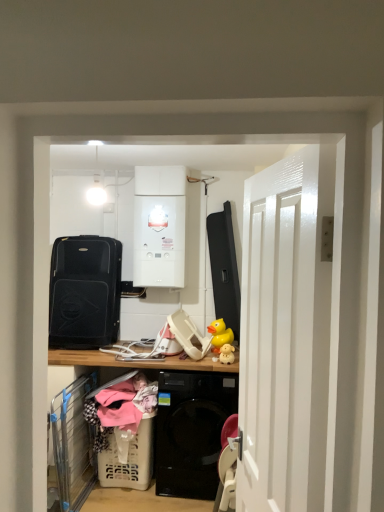
Question: Does white glossy boiler at upper center, which appears as the second appliance when viewed from the left, lie in front of white glossy door at right?

Choices:
 (A) yes
 (B) no

Answer: (B)

Question: Is white glossy boiler at upper center, which appears as the second appliance when viewed from the left, turned away from white glossy door at right?

Choices:
 (A) no
 (B) yes

Answer: (A)

Question: From a real-world perspective, is white glossy boiler at upper center, which appears as the second appliance when viewed from the left, positioned under white glossy door at right based on gravity?

Choices:
 (A) yes
 (B) no

Answer: (B)

Question: From the image's perspective, is white glossy boiler at upper center, acting as the first appliance starting from the right, beneath white glossy door at right?

Choices:
 (A) yes
 (B) no

Answer: (B)

Question: Does white glossy boiler at upper center, acting as the first appliance starting from the right, come behind white glossy door at right?

Choices:
 (A) yes
 (B) no

Answer: (A)

Question: Can you confirm if white glossy boiler at upper center, which appears as the second appliance when viewed from the left, is shorter than white glossy door at right?

Choices:
 (A) no
 (B) yes

Answer: (B)

Question: Considering the relative sizes of white glossy door at right and yellow rubber duck at center in the image provided, is white glossy door at right bigger than yellow rubber duck at center?

Choices:
 (A) no
 (B) yes

Answer: (B)

Question: From the image's perspective, is white glossy door at right on yellow rubber duck at center?

Choices:
 (A) yes
 (B) no

Answer: (A)

Question: Is the position of white glossy door at right less distant than that of yellow rubber duck at center?

Choices:
 (A) yes
 (B) no

Answer: (A)

Question: From a real-world perspective, is white glossy door at right positioned under yellow rubber duck at center based on gravity?

Choices:
 (A) yes
 (B) no

Answer: (B)

Question: Can you confirm if white glossy door at right is positioned to the left of yellow rubber duck at center?

Choices:
 (A) yes
 (B) no

Answer: (B)

Question: Is white glossy door at right at the right side of yellow rubber duck at center?

Choices:
 (A) no
 (B) yes

Answer: (B)

Question: Is black matte suitcase at left, which appears as the first appliance when viewed from the left, oriented towards white plastic laundry basket at lower left?

Choices:
 (A) yes
 (B) no

Answer: (B)